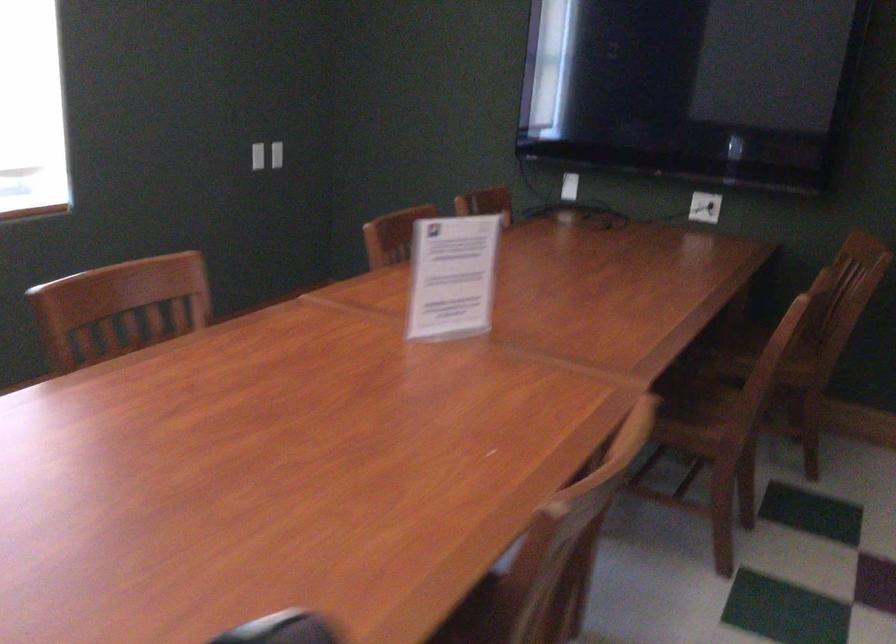
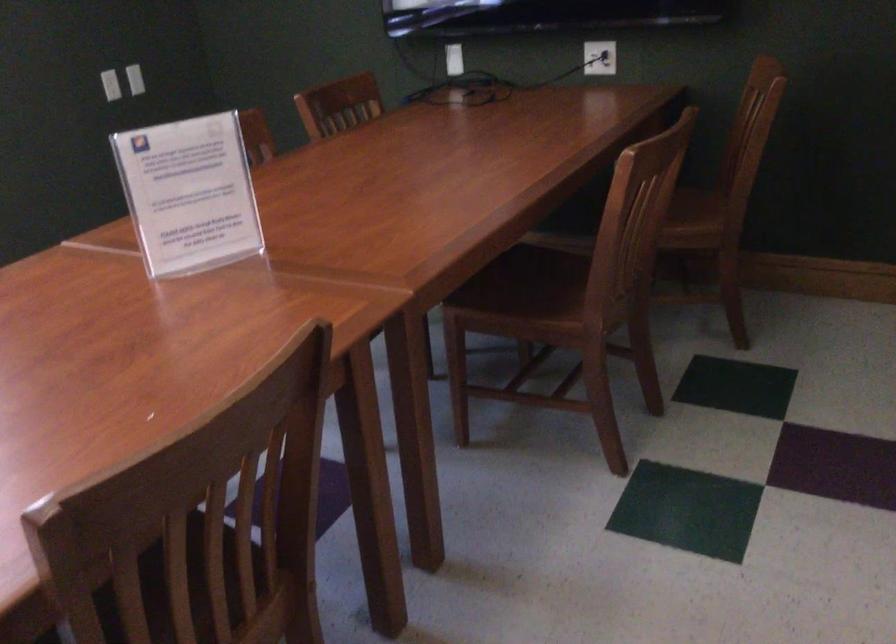
Find the pixel in the second image that matches point 445,275 in the first image.

(188, 194)